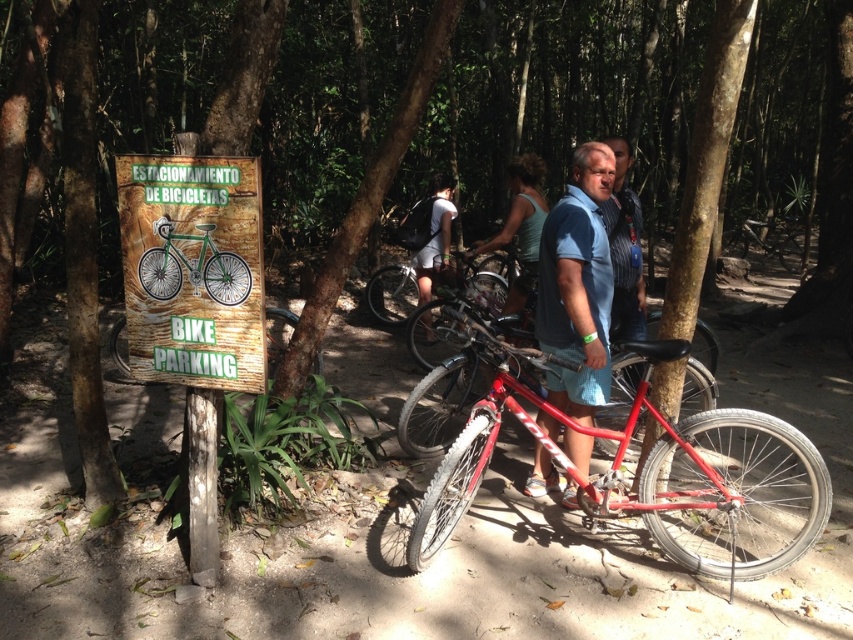
Based on the photo, you are a delivery person who needs to load a green matte bicycle at left and a matte green tank top at center into a small delivery van. The van has limited space. Based on the scene, which item should you load first to maximize space efficiency?

The green matte bicycle at left occupies less space than the matte green tank top at center, so you should load the matte green tank top at center first to leave more room for the smaller item later.

You are a delivery person trying to find the bike parking area. You see a sign on the left side of the frame indicating the parking area. There is also a metallic blue shirt at center. Which object is closer to the sign on the left?

The metallic blue shirt at center is located at point (x=579, y=280), which is further from the sign on the left compared to the red bicycle leaning against the tree trunk. Therefore, the red bicycle is closer to the sign on the left.